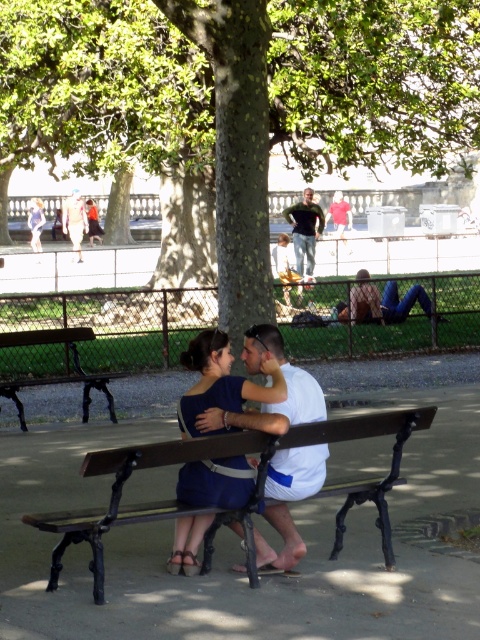
Question: Is wooden bench at center positioned at the back of white matte shirt at center?

Choices:
 (A) yes
 (B) no

Answer: (B)

Question: Observing the image, what is the correct spatial positioning of matte blue dress at center in reference to white matte shirt at center?

Choices:
 (A) left
 (B) right

Answer: (A)

Question: Which point is closer to the camera?

Choices:
 (A) dark blue jeans at center
 (B) wooden bench at left
 (C) white matte shirt at center
 (D) green textured tree at center

Answer: (C)

Question: Which point is closer to the camera taking this photo?

Choices:
 (A) (60, 522)
 (B) (350, 106)
 (C) (227, 390)

Answer: (A)

Question: Which point appears closest to the camera in this image?

Choices:
 (A) (92, 461)
 (B) (49, 337)

Answer: (A)

Question: Is wooden bench at center bigger than matte blue dress at center?

Choices:
 (A) no
 (B) yes

Answer: (B)